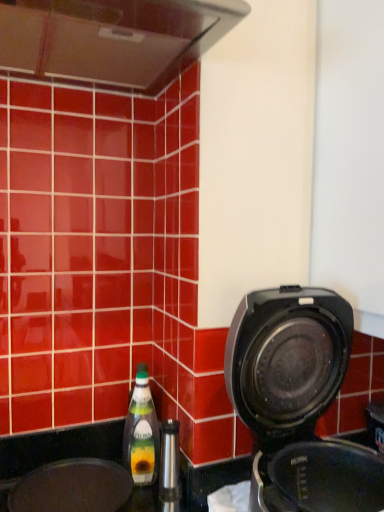
Question: Is green glass bottle at lower left touching black matte sink at lower left?

Choices:
 (A) no
 (B) yes

Answer: (A)

Question: Does green glass bottle at lower left appear on the left side of black matte sink at lower left?

Choices:
 (A) no
 (B) yes

Answer: (A)

Question: Does green glass bottle at lower left have a greater height compared to black matte sink at lower left?

Choices:
 (A) no
 (B) yes

Answer: (B)

Question: Does green glass bottle at lower left turn towards black matte sink at lower left?

Choices:
 (A) no
 (B) yes

Answer: (A)

Question: Can you confirm if green glass bottle at lower left is positioned to the right of black matte sink at lower left?

Choices:
 (A) no
 (B) yes

Answer: (B)

Question: From a real-world perspective, is green glass bottle at lower left physically located above or below black matte sink at lower left?

Choices:
 (A) above
 (B) below

Answer: (A)

Question: Looking at their shapes, would you say green glass bottle at lower left is wider or thinner than black matte sink at lower left?

Choices:
 (A) thin
 (B) wide

Answer: (A)

Question: From the image's perspective, is green glass bottle at lower left above or below black matte sink at lower left?

Choices:
 (A) below
 (B) above

Answer: (B)

Question: Is green glass bottle at lower left taller or shorter than black matte sink at lower left?

Choices:
 (A) tall
 (B) short

Answer: (A)

Question: Is black plastic coffee maker at right spatially inside black matte sink at lower left, or outside of it?

Choices:
 (A) outside
 (B) inside

Answer: (A)

Question: From a real-world perspective, is black plastic coffee maker at right physically located above or below black matte sink at lower left?

Choices:
 (A) below
 (B) above

Answer: (B)

Question: From the image's perspective, relative to black matte sink at lower left, is black plastic coffee maker at right above or below?

Choices:
 (A) above
 (B) below

Answer: (A)

Question: Considering the positions of black plastic coffee maker at right and black matte sink at lower left in the image, is black plastic coffee maker at right taller or shorter than black matte sink at lower left?

Choices:
 (A) tall
 (B) short

Answer: (A)

Question: From the image's perspective, is black matte sink at lower left positioned above or below green glass bottle at lower left?

Choices:
 (A) above
 (B) below

Answer: (B)

Question: Considering the positions of black matte sink at lower left and green glass bottle at lower left in the image, is black matte sink at lower left taller or shorter than green glass bottle at lower left?

Choices:
 (A) tall
 (B) short

Answer: (B)